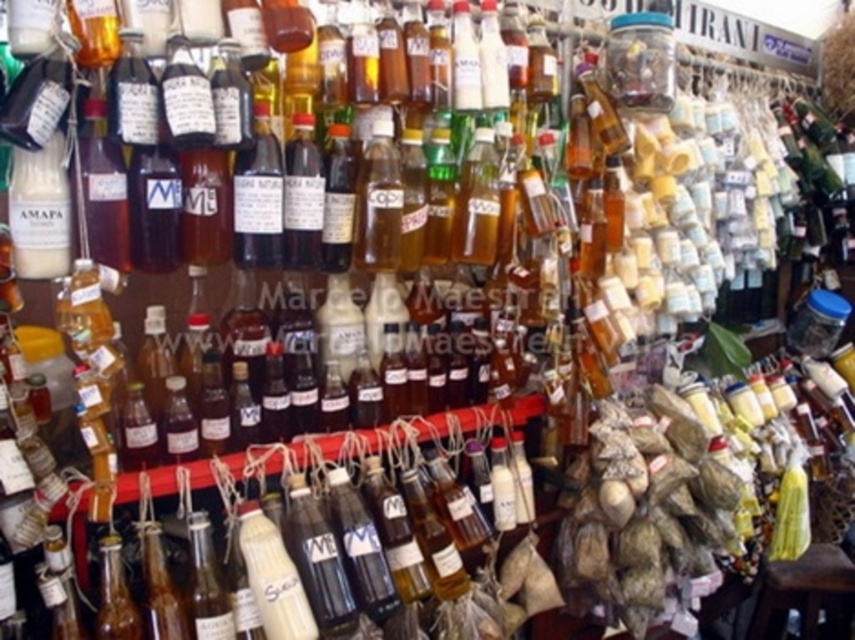
Which of these two, brown paper bag at center or brown wooden stool at lower right, stands shorter?

brown wooden stool at lower right

Is point (570, 588) in front of point (834, 593)?

Yes.

In order to click on brown paper bag at center in this screenshot , I will do `click(644, 512)`.